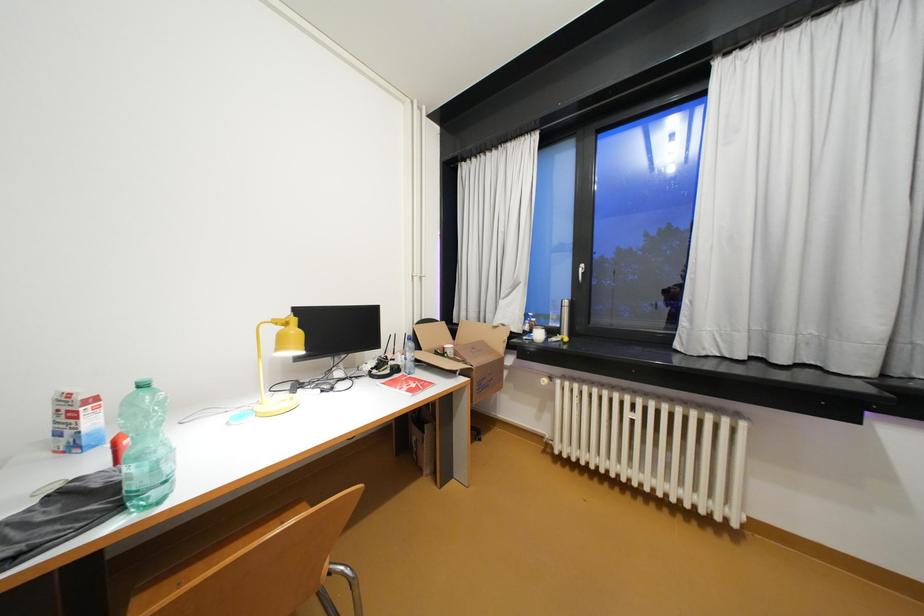
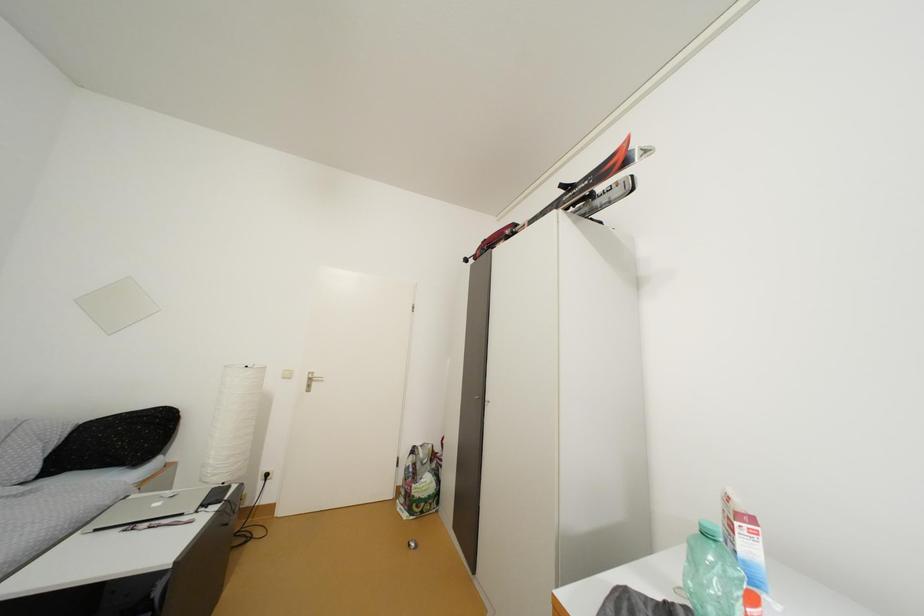
Question: The first image is from the beginning of the video and the second image is from the end. How did the camera likely rotate when shooting the video?

Choices:
 (A) Left
 (B) Right
 (C) Up
 (D) Down

Answer: (A)